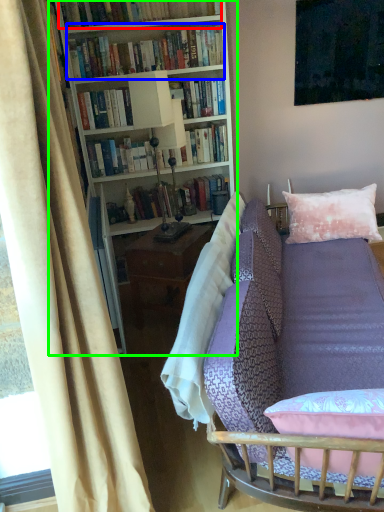
Question: Considering the real-world distances, which object is farthest from book (highlighted by a red box)? book (highlighted by a blue box) or bookcase (highlighted by a green box)?

Choices:
 (A) book
 (B) bookcase

Answer: (B)